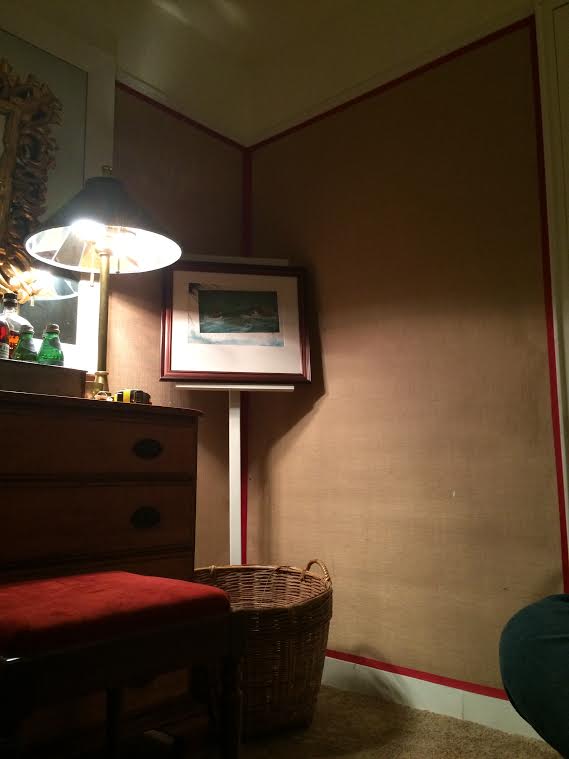
The image size is (569, 759). Find the location of `artwork`. artwork is located at coordinates (258, 332).